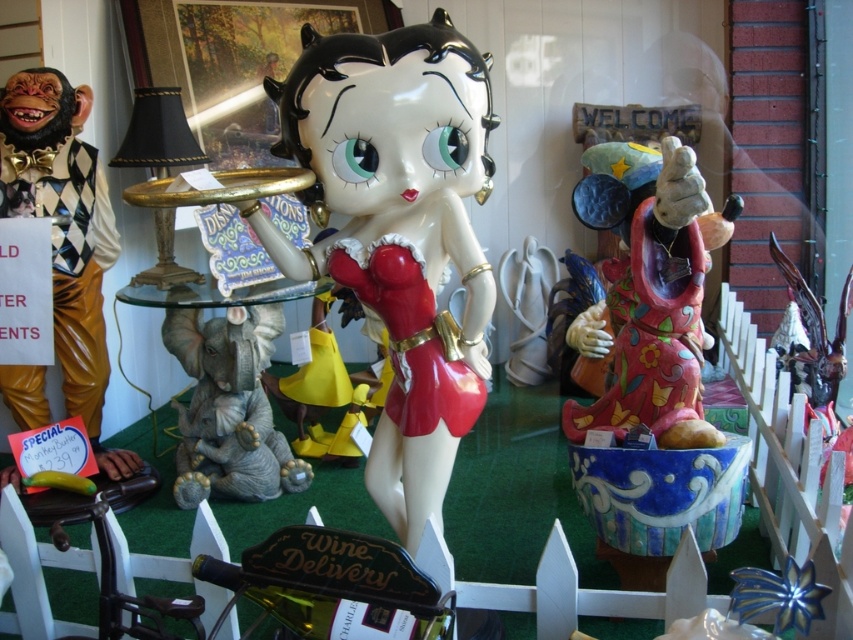
You are a customer in the store looking at the shop window. You want to take a closer look at the glossy ceramic betty boop at center and the matte ceramic statue at right. Which one do you need to step closer to in order to see better?

You need to step closer to the matte ceramic statue at right because it is further away from you compared to the glossy ceramic betty boop at center, which is closer.

You are a customer browsing the shop window and notice the wooden monkey at left and the satin gray elephant at lower left. Which figurine is located more to the left side of the display?

The wooden monkey at left is positioned on the left side of the satin gray elephant at lower left, so it is more to the left.

You are a customer in the store looking at the shop window. You see the matte ceramic statue at right and the satin gray elephant at lower left. Which one is positioned to the right of the other?

The matte ceramic statue at right is positioned to the right of the satin gray elephant at lower left.